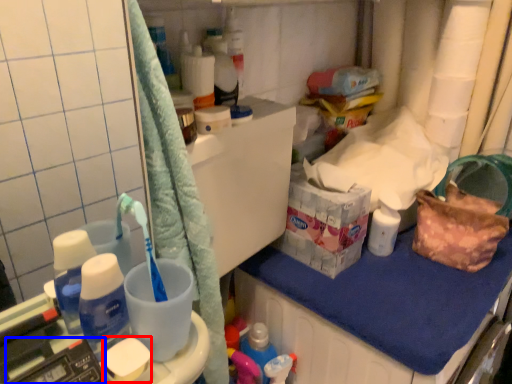
Question: Which point is closer to the camera, soap (highlighted by a red box) or scale (highlighted by a blue box)?

Choices:
 (A) soap
 (B) scale

Answer: (B)